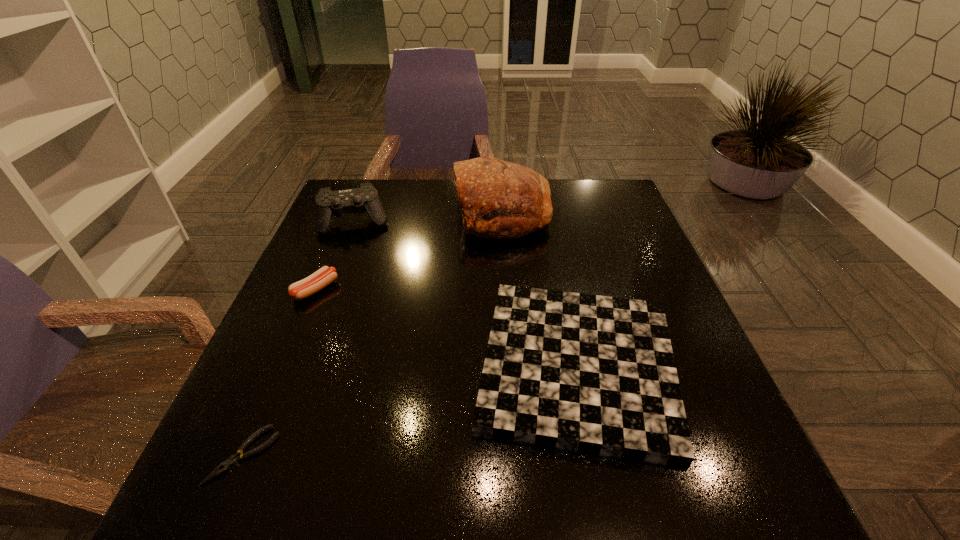
Find the location of a particular element. Image resolution: width=960 pixels, height=540 pixels. vacant space situated 0.150m on the left of the checkerboard is located at coordinates (396, 367).

You are a GUI agent. You are given a task and a screenshot of the screen. Output one action in this format:
    pyautogui.click(x=<x>, y=<y>)
    Task: Click on the free region located on the right of the shortest object
    
    Given the screenshot: What is the action you would take?
    pyautogui.click(x=384, y=455)

Find the location of a particular element. bread that is at the far edge is located at coordinates (498, 199).

The image size is (960, 540). I want to click on control positioned at the far edge, so click(x=328, y=204).

At what (x,y) coordinates should I click in order to perform the action: click on checkerboard present at the near edge. Please return your answer as a coordinate pair (x, y). Image resolution: width=960 pixels, height=540 pixels. Looking at the image, I should click on (594, 374).

You are a GUI agent. You are given a task and a screenshot of the screen. Output one action in this format:
    pyautogui.click(x=<x>, y=<y>)
    Task: Click on the pliers located at the near edge
    This screenshot has width=960, height=540.
    Given the screenshot: What is the action you would take?
    pyautogui.click(x=234, y=459)

Find the location of a particular element. This screenshot has width=960, height=540. control at the left edge is located at coordinates (328, 204).

Locate an element on the screen. The image size is (960, 540). sausage present at the left edge is located at coordinates (312, 284).

This screenshot has width=960, height=540. I want to click on pliers that is positioned at the left edge, so click(234, 459).

Identify the location of object present at the right edge. coord(594,374).